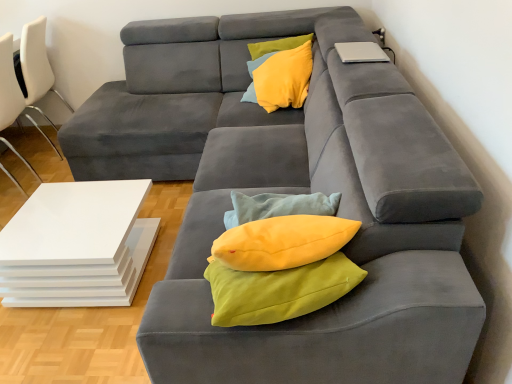
Question: From the image's perspective, is soft gray footrest at lower center positioned above or below white glossy table at lower left?

Choices:
 (A) above
 (B) below

Answer: (B)

Question: Relative to white glossy table at lower left, is soft gray footrest at lower center in front or behind?

Choices:
 (A) front
 (B) behind

Answer: (A)

Question: Which is nearer to the white plastic chair at left, which is the 1th chair from front to back?

Choices:
 (A) silver metallic laptop at upper right
 (B) soft gray footrest at lower center
 (C) yellow fabric pillow at upper center
 (D) white glossy table at lower left
 (E) white leather chair at left, the second chair when ordered from front to back

Answer: (E)

Question: Estimate the real-world distances between objects in this image. Which object is farther from the white leather chair at left, the first chair from the back?

Choices:
 (A) yellow fabric pillow at upper center
 (B) soft gray footrest at lower center
 (C) white glossy table at lower left
 (D) white plastic chair at left, which is the 1th chair from front to back
 (E) silver metallic laptop at upper right

Answer: (B)